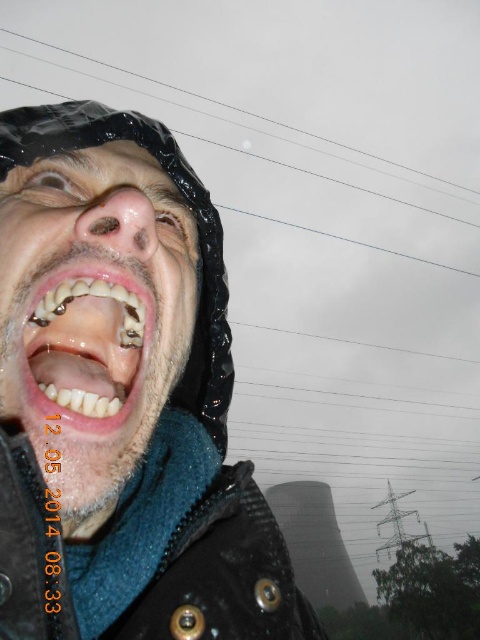
Question: Which point appears farthest from the camera in this image?

Choices:
 (A) (167, 396)
 (B) (132, 371)
 (C) (148, 81)
 (D) (217, 528)

Answer: (C)

Question: Does shiny metallic face at center appear under transparent plastic power line at upper center?

Choices:
 (A) yes
 (B) no

Answer: (A)

Question: Which object is the farthest from the shiny black jacket at center?

Choices:
 (A) transparent plastic power line at upper center
 (B) shiny metallic face at center
 (C) white glossy teeth at center

Answer: (A)

Question: Estimate the real-world distances between objects in this image. Which object is closer to the shiny black jacket at center?

Choices:
 (A) white glossy teeth at center
 (B) shiny metallic face at center
 (C) transparent plastic power line at upper center

Answer: (B)

Question: Is shiny black jacket at center to the right of white glossy teeth at center from the viewer's perspective?

Choices:
 (A) no
 (B) yes

Answer: (B)

Question: Does shiny black jacket at center appear on the right side of shiny metallic face at center?

Choices:
 (A) yes
 (B) no

Answer: (A)